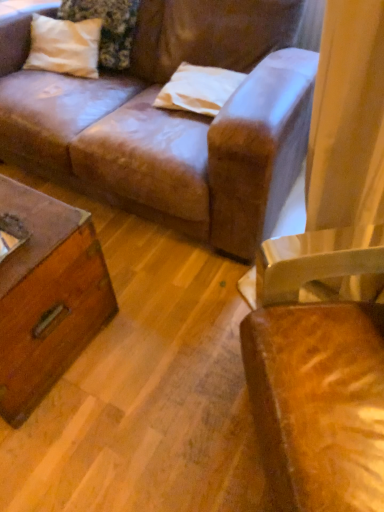
At what (x,y) coordinates should I click in order to perform the action: click on white cotton pillow at upper left, which ranks as the 1th pillow in top-to-bottom order. Please return your answer as a coordinate pair (x, y). This screenshot has height=512, width=384. Looking at the image, I should click on (107, 27).

Locate an element on the screen. The width and height of the screenshot is (384, 512). leather chair at right is located at coordinates (317, 384).

Between point (357, 338) and point (205, 99), which one is positioned in front?

Point (357, 338)

Could you tell me if leather chair at right is facing white matte pillow at upper center, the 1th pillow in the bottom-to-top sequence?

No, leather chair at right does not turn towards white matte pillow at upper center, the 1th pillow in the bottom-to-top sequence.

Is leather chair at right touching white matte pillow at upper center, placed as the first pillow when sorted from right to left?

No.

Considering the relative sizes of leather chair at right and white matte pillow at upper center, placed as the first pillow when sorted from right to left, in the image provided, is leather chair at right taller than white matte pillow at upper center, placed as the first pillow when sorted from right to left,?

Yes.

Can you tell me how much white matte pillow at upper center, the second pillow in the left-to-right sequence, and leather chair at right differ in facing direction?

white matte pillow at upper center, the second pillow in the left-to-right sequence, and leather chair at right are facing 55.2 degrees away from each other.

From the picture: Which object is positioned more to the right, white matte pillow at upper center, the second pillow in the left-to-right sequence, or leather chair at right?

leather chair at right.

Based on the photo, is white matte pillow at upper center, the second pillow in the left-to-right sequence, wider than leather chair at right?

Incorrect, the width of white matte pillow at upper center, the second pillow in the left-to-right sequence, does not surpass that of leather chair at right.

From a real-world perspective, is white matte pillow at upper center, placed as the 2th pillow when sorted from top to bottom, on top of leather chair at right?

Indeed, from a real-world perspective, white matte pillow at upper center, placed as the 2th pillow when sorted from top to bottom, stands above leather chair at right.

From their relative heights in the image, would you say white matte pillow at upper center, the second pillow in the left-to-right sequence, is taller or shorter than white cotton pillow at upper left, which ranks as the 1th pillow in top-to-bottom order?

In the image, white matte pillow at upper center, the second pillow in the left-to-right sequence, appears to be shorter than white cotton pillow at upper left, which ranks as the 1th pillow in top-to-bottom order.

Which is nearer, [209,108] or [67,15]?

Clearly, point [209,108] is closer to the camera than point [67,15].

Are white matte pillow at upper center, placed as the first pillow when sorted from right to left, and white cotton pillow at upper left, which is the 2th pillow in bottom-to-top order, far apart?

They are positioned close to each other.

In the image, is white matte pillow at upper center, placed as the 2th pillow when sorted from top to bottom, positioned in front of or behind white cotton pillow at upper left, which is the 2th pillow in bottom-to-top order?

Clearly, white matte pillow at upper center, placed as the 2th pillow when sorted from top to bottom, is in front of white cotton pillow at upper left, which is the 2th pillow in bottom-to-top order.

Can you confirm if leather chair at right is thinner than white cotton pillow at upper left, acting as the first pillow starting from the left?

Incorrect, the width of leather chair at right is not less than that of white cotton pillow at upper left, acting as the first pillow starting from the left.

From the image's perspective, is leather chair at right positioned above or below white cotton pillow at upper left, which is the 2th pillow in bottom-to-top order?

Based on their image positions, leather chair at right is located beneath white cotton pillow at upper left, which is the 2th pillow in bottom-to-top order.

Measure the distance between leather chair at right and white cotton pillow at upper left, which is the second pillow in right-to-left order.

A distance of 1.53 meters exists between leather chair at right and white cotton pillow at upper left, which is the second pillow in right-to-left order.

Can you confirm if leather chair at right is taller than white cotton pillow at upper left, which ranks as the 1th pillow in top-to-bottom order?

Indeed, leather chair at right has a greater height compared to white cotton pillow at upper left, which ranks as the 1th pillow in top-to-bottom order.

Does point (122, 25) come in front of point (279, 416)?

No, it is behind (279, 416).

Looking at their sizes, would you say white cotton pillow at upper left, acting as the first pillow starting from the left, is wider or thinner than leather chair at right?

Clearly, white cotton pillow at upper left, acting as the first pillow starting from the left, has less width compared to leather chair at right.

In the scene shown: From a real-world perspective, between white cotton pillow at upper left, which ranks as the 1th pillow in top-to-bottom order, and leather chair at right, who is vertically higher?

white cotton pillow at upper left, which ranks as the 1th pillow in top-to-bottom order, is physically above.

Visually, is white cotton pillow at upper left, which is the 2th pillow in bottom-to-top order, positioned to the left or to the right of leather chair at right?

white cotton pillow at upper left, which is the 2th pillow in bottom-to-top order, is positioned on leather chair at right's left side.

Which is behind, white cotton pillow at upper left, which is the second pillow in right-to-left order, or white matte pillow at upper center, the 1th pillow in the bottom-to-top sequence?

Positioned behind is white cotton pillow at upper left, which is the second pillow in right-to-left order.

At what (x,y) coordinates should I click in order to perform the action: click on pillow on the left side of white matte pillow at upper center, the 1th pillow in the bottom-to-top sequence. Please return your answer as a coordinate pair (x, y). This screenshot has height=512, width=384. Looking at the image, I should click on (107, 27).

Is white cotton pillow at upper left, which ranks as the 1th pillow in top-to-bottom order, facing away from white matte pillow at upper center, placed as the 2th pillow when sorted from top to bottom?

That's not correct — white cotton pillow at upper left, which ranks as the 1th pillow in top-to-bottom order, is not looking away from white matte pillow at upper center, placed as the 2th pillow when sorted from top to bottom.

Which of these two, white cotton pillow at upper left, which ranks as the 1th pillow in top-to-bottom order, or white matte pillow at upper center, placed as the 2th pillow when sorted from top to bottom, stands taller?

Standing taller between the two is white cotton pillow at upper left, which ranks as the 1th pillow in top-to-bottom order.

From the leather chair at right, count the 1st pillow to the left and point to it. Please provide its 2D coordinates.

[(198, 89)]

At what (x,y) coordinates should I click in order to perform the action: click on chair that is under the white matte pillow at upper center, placed as the 2th pillow when sorted from top to bottom (from a real-world perspective). Please return your answer as a coordinate pair (x, y). Looking at the image, I should click on coord(317,384).

From the image, which object appears to be farther from white matte pillow at upper center, the second pillow in the left-to-right sequence, white cotton pillow at upper left, which is the second pillow in right-to-left order, or leather chair at right?

leather chair at right is positioned further to the anchor white matte pillow at upper center, the second pillow in the left-to-right sequence.

Considering their positions, is white matte pillow at upper center, the 1th pillow in the bottom-to-top sequence, positioned closer to leather chair at right than white cotton pillow at upper left, which ranks as the 1th pillow in top-to-bottom order?

white matte pillow at upper center, the 1th pillow in the bottom-to-top sequence, is closer to leather chair at right.

Looking at the image, which one is located closer to white cotton pillow at upper left, which is the second pillow in right-to-left order, white matte pillow at upper center, the second pillow in the left-to-right sequence, or leather chair at right?

white matte pillow at upper center, the second pillow in the left-to-right sequence.

When comparing their distances from leather chair at right, does white cotton pillow at upper left, which is the second pillow in right-to-left order, or white matte pillow at upper center, placed as the first pillow when sorted from right to left, seem closer?

white matte pillow at upper center, placed as the first pillow when sorted from right to left, is positioned closer to the anchor leather chair at right.

Based on their spatial positions, is leather chair at right or white cotton pillow at upper left, which is the 2th pillow in bottom-to-top order, closer to white matte pillow at upper center, placed as the first pillow when sorted from right to left?

The object closer to white matte pillow at upper center, placed as the first pillow when sorted from right to left, is white cotton pillow at upper left, which is the 2th pillow in bottom-to-top order.

Estimate the real-world distances between objects in this image. Which object is further from white cotton pillow at upper left, acting as the first pillow starting from the left, leather chair at right or white matte pillow at upper center, placed as the 2th pillow when sorted from top to bottom?

The object further to white cotton pillow at upper left, acting as the first pillow starting from the left, is leather chair at right.

Identify the location of pillow that lies between white cotton pillow at upper left, which ranks as the 1th pillow in top-to-bottom order, and leather chair at right from top to bottom. (198, 89).